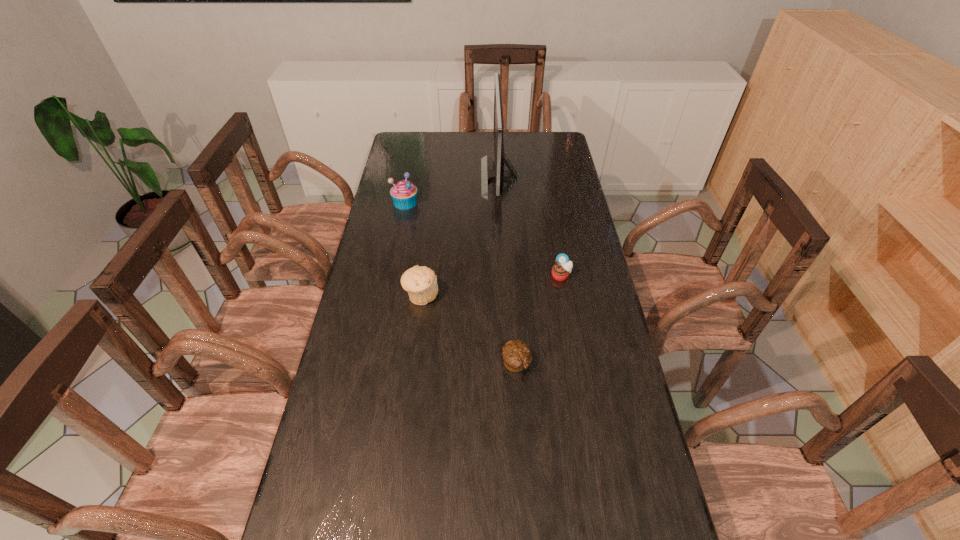
The image size is (960, 540). In order to click on free space between the nearest muffin and the rightmost object in this screenshot , I will do `click(539, 319)`.

The width and height of the screenshot is (960, 540). I want to click on free space between the nearest object and the farthest muffin, so click(x=461, y=282).

Where is `vacant space that is in between the farthest muffin and the third farthest muffin`? vacant space that is in between the farthest muffin and the third farthest muffin is located at coordinates (413, 249).

Where is `vacant space in between the rightmost muffin and the farthest muffin`? The height and width of the screenshot is (540, 960). vacant space in between the rightmost muffin and the farthest muffin is located at coordinates (483, 239).

Image resolution: width=960 pixels, height=540 pixels. In order to click on free space between the second nearest muffin and the second shortest muffin in this screenshot , I will do `click(492, 286)`.

Locate which object ranks third in proximity to the monitor. Please provide its 2D coordinates. Your answer should be formatted as a tuple, i.e. [(x, y)], where the tuple contains the x and y coordinates of a point satisfying the conditions above.

[(420, 282)]

Locate which object ranks fourth in proximity to the third farthest muffin. Please provide its 2D coordinates. Your answer should be formatted as a tuple, i.e. [(x, y)], where the tuple contains the x and y coordinates of a point satisfying the conditions above.

[(499, 174)]

Choose which muffin is the nearest neighbor to the second nearest muffin. Please provide its 2D coordinates. Your answer should be formatted as a tuple, i.e. [(x, y)], where the tuple contains the x and y coordinates of a point satisfying the conditions above.

[(517, 355)]

Find the location of a particular element. The image size is (960, 540). muffin that stands as the third closest to the shortest muffin is located at coordinates (404, 194).

Find the location of a particular element. The image size is (960, 540). vacant area in the image that satisfies the following two spatial constraints: 1. on the front side of the farthest muffin; 2. on the left side of the fourth farthest object is located at coordinates (387, 295).